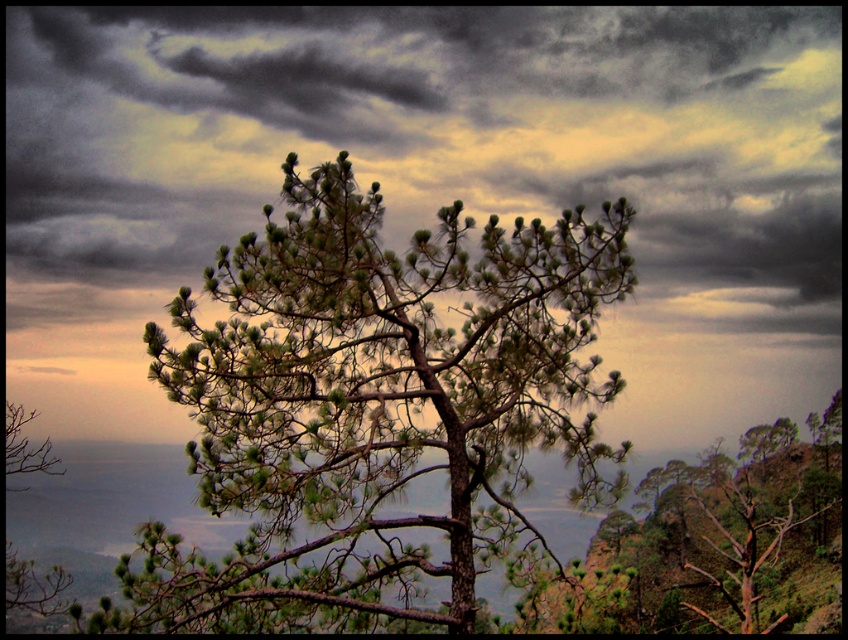
In the scene shown: You are an artist sketching this landscape and want to place the dark gray cloud at upper center accurately. According to the coordinates provided, what are the exact coordinates where you should position it?

The dark gray cloud at upper center should be positioned at the coordinates point (x=427, y=141).

You are standing at the base of the solitary pine tree in the foreground. Looking up, you notice a specific point in the sky. What object is located at the coordinates point (x=427, y=141)?

The dark gray cloud at upper center is located at point (x=427, y=141).